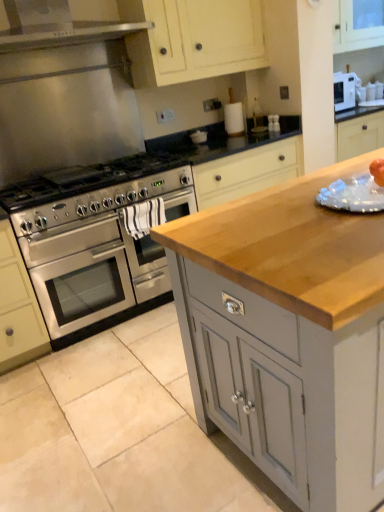
Where is `matte cream cabinet at upper center, which is the first cabinetry from back to front`? This screenshot has height=512, width=384. matte cream cabinet at upper center, which is the first cabinetry from back to front is located at coordinates (194, 39).

From a real-world perspective, between stainless steel gas stove at left and matte cream cabinet at upper center, which is the 2th cabinetry in front-to-back order, who is vertically higher?

matte cream cabinet at upper center, which is the 2th cabinetry in front-to-back order.

Is point (143, 175) less distant than point (193, 0)?

Yes, point (143, 175) is in front of point (193, 0).

Considering the relative positions of stainless steel gas stove at left and matte cream cabinet at upper center, placed as the first cabinetry when sorted from top to bottom, in the image provided, is stainless steel gas stove at left to the right of matte cream cabinet at upper center, placed as the first cabinetry when sorted from top to bottom, from the viewer's perspective?

In fact, stainless steel gas stove at left is to the left of matte cream cabinet at upper center, placed as the first cabinetry when sorted from top to bottom.

Who is smaller, stainless steel gas stove at left or matte cream cabinet at upper center, placed as the first cabinetry when sorted from top to bottom?

With smaller size is stainless steel gas stove at left.

Is the position of matte cream cabinet at upper center, placed as the first cabinetry when sorted from top to bottom, less distant than that of stainless steel oven at left?

No, matte cream cabinet at upper center, placed as the first cabinetry when sorted from top to bottom, is behind stainless steel oven at left.

Consider the image. Who is smaller, matte cream cabinet at upper center, which is the 2th cabinetry in front-to-back order, or stainless steel oven at left?

Smaller between the two is matte cream cabinet at upper center, which is the 2th cabinetry in front-to-back order.

Is matte cream cabinet at upper center, which is the 2th cabinetry in front-to-back order, not within stainless steel oven at left?

Yes, matte cream cabinet at upper center, which is the 2th cabinetry in front-to-back order, is not within stainless steel oven at left.

Between point (103, 247) and point (271, 238), which one is positioned behind?

Positioned behind is point (103, 247).

From the image's perspective, is stainless steel oven at left on wooden countertop at center, which is the 2th cabinetry from top to bottom?

Yes, from the image's perspective, stainless steel oven at left is above wooden countertop at center, which is the 2th cabinetry from top to bottom.

Can wooden countertop at center, the 1th cabinetry when ordered from bottom to top, be found inside stainless steel oven at left?

That's incorrect, wooden countertop at center, the 1th cabinetry when ordered from bottom to top, is not inside stainless steel oven at left.

How different are the orientations of stainless steel oven at left and wooden countertop at center, the 1th cabinetry when ordered from bottom to top, in degrees?

The angle between the facing direction of stainless steel oven at left and the facing direction of wooden countertop at center, the 1th cabinetry when ordered from bottom to top, is 90.3 degrees.

Considering the sizes of stainless steel oven at left and stainless steel gas stove at left in the image, is stainless steel oven at left taller or shorter than stainless steel gas stove at left?

In the image, stainless steel oven at left appears to be taller than stainless steel gas stove at left.

Is stainless steel oven at left oriented towards stainless steel gas stove at left?

No.

Between stainless steel oven at left and stainless steel gas stove at left, which one has larger size?

stainless steel oven at left is bigger.

Where is `gas stove above the wooden countertop at center, the 1th cabinetry when ordered from bottom to top (from a real-world perspective)`? gas stove above the wooden countertop at center, the 1th cabinetry when ordered from bottom to top (from a real-world perspective) is located at coordinates (83, 180).

Is wooden countertop at center, the second cabinetry viewed from the back, positioned far away from stainless steel gas stove at left?

That's right, there is a large distance between wooden countertop at center, the second cabinetry viewed from the back, and stainless steel gas stove at left.

Would you say stainless steel gas stove at left is part of wooden countertop at center, the 1th cabinetry when ordered from bottom to top,'s contents?

Actually, stainless steel gas stove at left is outside wooden countertop at center, the 1th cabinetry when ordered from bottom to top.

Who is taller, stainless steel oven at left or matte cream cabinet at upper center, which is counted as the 2th cabinetry, starting from the bottom?

Standing taller between the two is stainless steel oven at left.

Between stainless steel oven at left and matte cream cabinet at upper center, which is counted as the 2th cabinetry, starting from the bottom, which one appears on the right side from the viewer's perspective?

From the viewer's perspective, matte cream cabinet at upper center, which is counted as the 2th cabinetry, starting from the bottom, appears more on the right side.

From the picture: Which object is closer to the camera taking this photo, stainless steel oven at left or matte cream cabinet at upper center, which is the first cabinetry from back to front?

stainless steel oven at left is more forward.

From the image's perspective, is stainless steel oven at left on matte cream cabinet at upper center, which is counted as the 2th cabinetry, starting from the bottom?

No, from the image's perspective, stainless steel oven at left is not on top of matte cream cabinet at upper center, which is counted as the 2th cabinetry, starting from the bottom.

Is wooden countertop at center, which is the first cabinetry in front-to-back order, positioned in front of stainless steel oven at left?

Yes, wooden countertop at center, which is the first cabinetry in front-to-back order, is closer to the viewer.

Considering the points (362, 380) and (50, 278), which point is behind, point (362, 380) or point (50, 278)?

Positioned behind is point (50, 278).

Is wooden countertop at center, the 1th cabinetry when ordered from bottom to top, facing away from stainless steel oven at left?

No, wooden countertop at center, the 1th cabinetry when ordered from bottom to top,'s orientation is not away from stainless steel oven at left.

The image size is (384, 512). What are the coordinates of `the 1st cabinetry to the right of the stainless steel gas stove at left, counting from the anchor's position` in the screenshot? It's located at (194, 39).

Locate an element on the screen. This screenshot has width=384, height=512. oven lying below the matte cream cabinet at upper center, which is the first cabinetry from back to front (from the image's perspective) is located at coordinates (93, 272).

Based on their spatial positions, is matte cream cabinet at upper center, which is the first cabinetry from back to front, or stainless steel gas stove at left closer to stainless steel oven at left?

Based on the image, stainless steel gas stove at left appears to be nearer to stainless steel oven at left.

Looking at the image, which one is located closer to matte cream cabinet at upper center, placed as the first cabinetry when sorted from top to bottom, wooden countertop at center, which is the first cabinetry in front-to-back order, or stainless steel gas stove at left?

stainless steel gas stove at left is closer to matte cream cabinet at upper center, placed as the first cabinetry when sorted from top to bottom.

Estimate the real-world distances between objects in this image. Which object is further from wooden countertop at center, the 1th cabinetry when ordered from bottom to top, stainless steel gas stove at left or stainless steel oven at left?

stainless steel gas stove at left lies further to wooden countertop at center, the 1th cabinetry when ordered from bottom to top, than the other object.

Based on their spatial positions, is stainless steel gas stove at left or matte cream cabinet at upper center, which is the first cabinetry from back to front, closer to stainless steel oven at left?

Based on the image, stainless steel gas stove at left appears to be nearer to stainless steel oven at left.

Estimate the real-world distances between objects in this image. Which object is further from stainless steel gas stove at left, wooden countertop at center, which is the 2th cabinetry from top to bottom, or matte cream cabinet at upper center, which is the first cabinetry from back to front?

wooden countertop at center, which is the 2th cabinetry from top to bottom, lies further to stainless steel gas stove at left than the other object.

When comparing their distances from stainless steel gas stove at left, does matte cream cabinet at upper center, which is the first cabinetry from back to front, or stainless steel oven at left seem further?

matte cream cabinet at upper center, which is the first cabinetry from back to front, is positioned further to the anchor stainless steel gas stove at left.

Consider the image. Estimate the real-world distances between objects in this image. Which object is further from stainless steel oven at left, wooden countertop at center, the 1th cabinetry when ordered from bottom to top, or matte cream cabinet at upper center, which is the 2th cabinetry in front-to-back order?

wooden countertop at center, the 1th cabinetry when ordered from bottom to top.

When comparing their distances from stainless steel oven at left, does stainless steel gas stove at left or wooden countertop at center, the second cabinetry viewed from the back, seem further?

wooden countertop at center, the second cabinetry viewed from the back, lies further to stainless steel oven at left than the other object.

At what (x,y) coordinates should I click in order to perform the action: click on oven between stainless steel gas stove at left and wooden countertop at center, which is the first cabinetry in front-to-back order. Please return your answer as a coordinate pair (x, y). This screenshot has height=512, width=384. Looking at the image, I should click on (93, 272).

Find the location of a particular element. oven that lies between matte cream cabinet at upper center, which is the first cabinetry from back to front, and wooden countertop at center, the 1th cabinetry when ordered from bottom to top, from top to bottom is located at coordinates (93, 272).

Where is `gas stove between matte cream cabinet at upper center, which is counted as the 2th cabinetry, starting from the bottom, and wooden countertop at center, which is the first cabinetry in front-to-back order, in the up-down direction`? gas stove between matte cream cabinet at upper center, which is counted as the 2th cabinetry, starting from the bottom, and wooden countertop at center, which is the first cabinetry in front-to-back order, in the up-down direction is located at coordinates (83, 180).

I want to click on gas stove between matte cream cabinet at upper center, which is counted as the 2th cabinetry, starting from the bottom, and stainless steel oven at left in the up-down direction, so click(x=83, y=180).